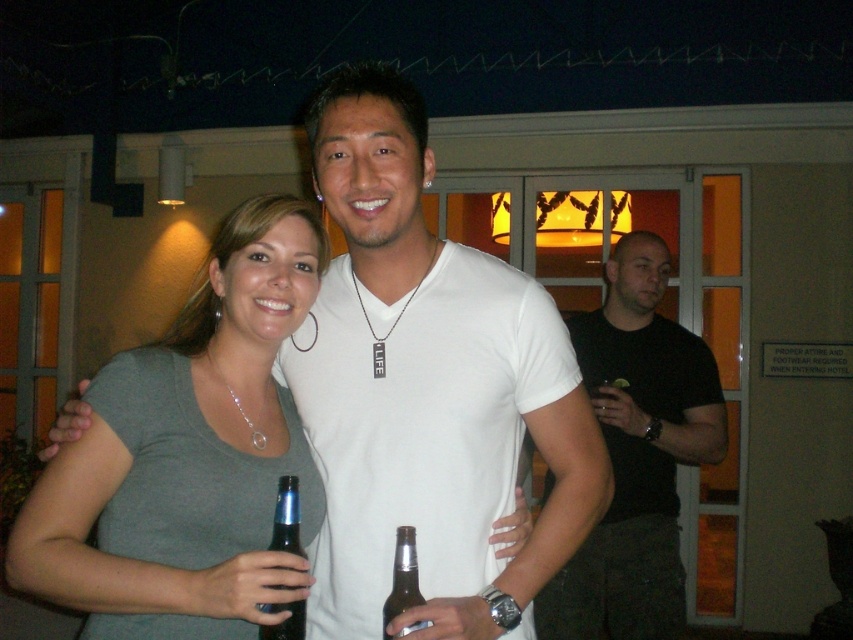
How much distance is there between gray matte shirt at center and black matte shirt at right?

A distance of 1.60 meters exists between gray matte shirt at center and black matte shirt at right.

Is gray matte shirt at center wider than black matte shirt at right?

No, gray matte shirt at center is not wider than black matte shirt at right.

Does point (265, 349) come in front of point (662, 572)?

Yes, point (265, 349) is in front of point (662, 572).

At what (x,y) coordinates should I click in order to perform the action: click on gray matte shirt at center. Please return your answer as a coordinate pair (x, y). The width and height of the screenshot is (853, 640). Looking at the image, I should click on (189, 456).

Which is more to the right, gray matte shirt at center or brown glass bottle at center?

From the viewer's perspective, brown glass bottle at center appears more on the right side.

Who is higher up, gray matte shirt at center or brown glass bottle at center?

Positioned higher is gray matte shirt at center.

Between point (187, 548) and point (415, 557), which one is positioned in front?

Positioned in front is point (415, 557).

Locate an element on the screen. The height and width of the screenshot is (640, 853). gray matte shirt at center is located at coordinates click(x=189, y=456).

Where is `white matte t-shirt at center`? white matte t-shirt at center is located at coordinates (428, 388).

Is white matte t-shirt at center taller than brown glass bottle at center?

Correct, white matte t-shirt at center is much taller as brown glass bottle at center.

This screenshot has width=853, height=640. Describe the element at coordinates (428, 388) in the screenshot. I see `white matte t-shirt at center` at that location.

You are a GUI agent. You are given a task and a screenshot of the screen. Output one action in this format:
    pyautogui.click(x=<x>, y=<y>)
    Task: Click on the white matte t-shirt at center
    The width and height of the screenshot is (853, 640).
    Given the screenshot: What is the action you would take?
    pyautogui.click(x=428, y=388)